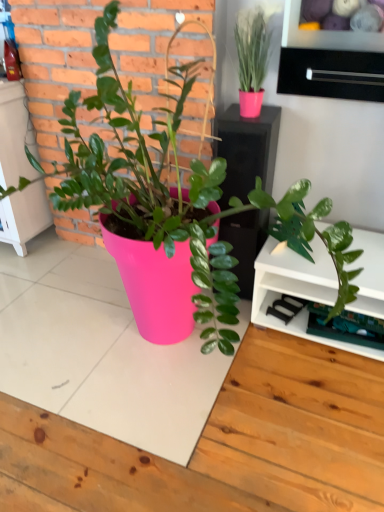
Locate an element on the screen. The height and width of the screenshot is (512, 384). pink matte pot at center is located at coordinates (145, 184).

This screenshot has height=512, width=384. What do you see at coordinates (145, 184) in the screenshot?
I see `pink matte pot at center` at bounding box center [145, 184].

Describe the element at coordinates (331, 74) in the screenshot. Image resolution: width=384 pixels, height=512 pixels. I see `black matte drawer at upper right` at that location.

Where is `black matte drawer at upper right`? black matte drawer at upper right is located at coordinates (331, 74).

This screenshot has width=384, height=512. Find the location of `pink matte pot at center`. pink matte pot at center is located at coordinates (145, 184).

In the image, is pink matte pot at center on the left side or the right side of black matte drawer at upper right?

From the image, it's evident that pink matte pot at center is to the left of black matte drawer at upper right.

Which object is further away from the camera taking this photo, pink matte pot at center or black matte drawer at upper right?

black matte drawer at upper right is further away from the camera.

Is point (144, 283) less distant than point (348, 66)?

No, (144, 283) is behind (348, 66).

From the image's perspective, is pink matte pot at center above black matte drawer at upper right?

No.

From a real-world perspective, which is physically below, pink matte pot at center or black matte drawer at upper right?

pink matte pot at center, from a real-world perspective.

Can you confirm if pink matte pot at center is wider than black matte drawer at upper right?

Correct, the width of pink matte pot at center exceeds that of black matte drawer at upper right.

In terms of height, does pink matte pot at center look taller or shorter compared to black matte drawer at upper right?

pink matte pot at center is taller than black matte drawer at upper right.

Which of these two, pink matte pot at center or black matte drawer at upper right, is smaller?

With smaller size is black matte drawer at upper right.

Do you think pink matte pot at center is within black matte drawer at upper right, or outside of it?

The correct answer is: outside.

Can you see pink matte pot at center touching black matte drawer at upper right?

No, pink matte pot at center is not with black matte drawer at upper right.

Is pink matte pot at center oriented away from black matte drawer at upper right?

Absolutely, pink matte pot at center is directed away from black matte drawer at upper right.

What's the angular difference between pink matte pot at center and black matte drawer at upper right's facing directions?

The angle between the facing direction of pink matte pot at center and the facing direction of black matte drawer at upper right is 1.42 degrees.

What are the coordinates of `houseplant below the black matte drawer at upper right (from the image's perspective)` in the screenshot? It's located at (145, 184).

Between black matte drawer at upper right and pink matte pot at center, which one appears on the left side from the viewer's perspective?

pink matte pot at center.

Does black matte drawer at upper right lie in front of pink matte pot at center?

No, black matte drawer at upper right is further to the viewer.

Which is in front, point (381, 99) or point (224, 300)?

The point (224, 300) is closer to the camera.

From the image's perspective, relative to pink matte pot at center, is black matte drawer at upper right above or below?

black matte drawer at upper right is above pink matte pot at center.

From a real-world perspective, is black matte drawer at upper right above or below pink matte pot at center?

Clearly, from a real-world perspective, black matte drawer at upper right is above pink matte pot at center.

Consider the image. Which object is thinner, black matte drawer at upper right or pink matte pot at center?

black matte drawer at upper right is thinner.

Is black matte drawer at upper right taller than pink matte pot at center?

No.

Between black matte drawer at upper right and pink matte pot at center, which one has larger size?

Bigger between the two is pink matte pot at center.

Is black matte drawer at upper right surrounding pink matte pot at center?

No, pink matte pot at center is located outside of black matte drawer at upper right.

Is black matte drawer at upper right directly adjacent to pink matte pot at center?

No, black matte drawer at upper right is not beside pink matte pot at center.

Is black matte drawer at upper right facing towards pink matte pot at center?

Yes.

How many degrees apart are the facing directions of black matte drawer at upper right and pink matte pot at center?

black matte drawer at upper right and pink matte pot at center are facing 1.42 degrees away from each other.

Measure the distance from black matte drawer at upper right to pink matte pot at center.

21.54 inches.

I want to click on drawer that appears above the pink matte pot at center (from a real-world perspective), so click(x=331, y=74).

The image size is (384, 512). Find the location of `houseplant located on the left of black matte drawer at upper right`. houseplant located on the left of black matte drawer at upper right is located at coordinates (145, 184).

The width and height of the screenshot is (384, 512). I want to click on houseplant in front of the black matte drawer at upper right, so click(145, 184).